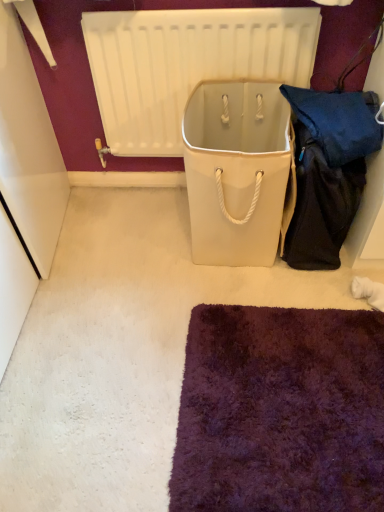
You are a GUI agent. You are given a task and a screenshot of the screen. Output one action in this format:
    pyautogui.click(x=<x>, y=<y>)
    Task: Click on the white canvas cooler at center
    The image size is (384, 512).
    Given the screenshot: What is the action you would take?
    pyautogui.click(x=236, y=170)

What do you see at coordinates (236, 170) in the screenshot? The image size is (384, 512). I see `white canvas cooler at center` at bounding box center [236, 170].

The height and width of the screenshot is (512, 384). What do you see at coordinates (187, 64) in the screenshot?
I see `white matte radiator at upper center` at bounding box center [187, 64].

The height and width of the screenshot is (512, 384). Find the location of `white matte radiator at upper center`. white matte radiator at upper center is located at coordinates (187, 64).

You are a GUI agent. You are given a task and a screenshot of the screen. Output one action in this format:
    pyautogui.click(x=<x>, y=<y>)
    Task: Click on the white canvas cooler at center
    This screenshot has height=512, width=384.
    Given the screenshot: What is the action you would take?
    pyautogui.click(x=236, y=170)

Between white matte radiator at upper center and white canvas cooler at center, which one appears on the right side from the viewer's perspective?

Positioned to the right is white canvas cooler at center.

Which object is further away from the camera, white matte radiator at upper center or white canvas cooler at center?

Positioned behind is white matte radiator at upper center.

Considering the points (179, 125) and (277, 97), which point is in front, point (179, 125) or point (277, 97)?

Point (277, 97)

From the image's perspective, is white matte radiator at upper center beneath white canvas cooler at center?

No, from the image's perspective, white matte radiator at upper center is not beneath white canvas cooler at center.

From a real-world perspective, is white matte radiator at upper center located higher than white canvas cooler at center?

Yes, from a real-world perspective, white matte radiator at upper center is over white canvas cooler at center

Does white matte radiator at upper center have a greater width compared to white canvas cooler at center?

In fact, white matte radiator at upper center might be narrower than white canvas cooler at center.

Which of these two, white matte radiator at upper center or white canvas cooler at center, stands taller?

Standing taller between the two is white matte radiator at upper center.

Can you confirm if white matte radiator at upper center is bigger than white canvas cooler at center?

No, white matte radiator at upper center is not bigger than white canvas cooler at center.

Is white matte radiator at upper center completely or partially outside of white canvas cooler at center?

white matte radiator at upper center lies outside white canvas cooler at center's area.

Is white matte radiator at upper center far from white canvas cooler at center?

No.

In the scene shown: Is white matte radiator at upper center turned away from white canvas cooler at center?

Yes.

This screenshot has width=384, height=512. In order to click on radiator that appears on the left of white canvas cooler at center in this screenshot , I will do `click(187, 64)`.

Can you confirm if white canvas cooler at center is positioned to the right of white matte radiator at upper center?

Correct, you'll find white canvas cooler at center to the right of white matte radiator at upper center.

Which is in front, white canvas cooler at center or white matte radiator at upper center?

white canvas cooler at center is in front.

Is point (257, 246) farther from viewer compared to point (131, 92)?

No.

From the image's perspective, is white canvas cooler at center on white matte radiator at upper center?

Actually, white canvas cooler at center appears below white matte radiator at upper center in the image.

From a real-world perspective, who is located higher, white canvas cooler at center or white matte radiator at upper center?

From a 3D spatial view, white matte radiator at upper center is above.

Considering the relative sizes of white canvas cooler at center and white matte radiator at upper center in the image provided, is white canvas cooler at center thinner than white matte radiator at upper center?

In fact, white canvas cooler at center might be wider than white matte radiator at upper center.

Which of these two, white canvas cooler at center or white matte radiator at upper center, stands taller?

With more height is white matte radiator at upper center.

Is white canvas cooler at center smaller than white matte radiator at upper center?

Incorrect, white canvas cooler at center is not smaller in size than white matte radiator at upper center.

Would you say white canvas cooler at center is inside or outside white matte radiator at upper center?

white canvas cooler at center exists outside the volume of white matte radiator at upper center.

Are white canvas cooler at center and white matte radiator at upper center far apart?

Actually, white canvas cooler at center and white matte radiator at upper center are a little close together.

Is white canvas cooler at center facing towards white matte radiator at upper center?

No, white canvas cooler at center is not oriented towards white matte radiator at upper center.

How much distance is there between white canvas cooler at center and white matte radiator at upper center?

white canvas cooler at center is 10.16 inches from white matte radiator at upper center.

Image resolution: width=384 pixels, height=512 pixels. Identify the location of radiator above the white canvas cooler at center (from a real-world perspective). (187, 64).

You are a GUI agent. You are given a task and a screenshot of the screen. Output one action in this format:
    pyautogui.click(x=<x>, y=<y>)
    Task: Click on the cooler in front of the white matte radiator at upper center
    Image resolution: width=384 pixels, height=512 pixels.
    Given the screenshot: What is the action you would take?
    pyautogui.click(x=236, y=170)

Image resolution: width=384 pixels, height=512 pixels. I want to click on radiator above the white canvas cooler at center (from the image's perspective), so click(x=187, y=64).